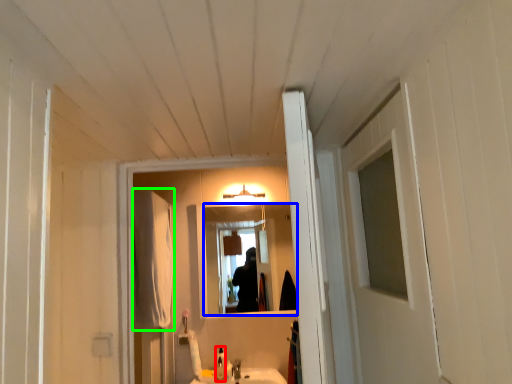
Question: Which object is positioned closest to bottle (highlighted by a red box)? Select from mirror (highlighted by a blue box) and curtain (highlighted by a green box).

Choices:
 (A) mirror
 (B) curtain

Answer: (B)